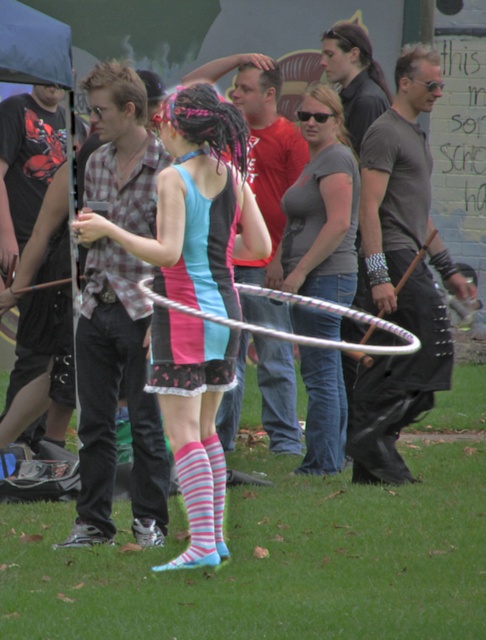
Is point (135, 595) more distant than point (314, 108)?

That is False.

Is green grass at lower center to the left of matte gray shirt at center from the viewer's perspective?

Correct, you'll find green grass at lower center to the left of matte gray shirt at center.

Describe the element at coordinates (271, 561) in the screenshot. This screenshot has height=640, width=486. I see `green grass at lower center` at that location.

The width and height of the screenshot is (486, 640). I want to click on green grass at lower center, so click(x=271, y=561).

Which is above, green grass at lower center or pink fabric skirt at center?

pink fabric skirt at center is above.

Which is in front, point (262, 609) or point (142, 324)?

Point (262, 609)

Is point (91, 579) closer to camera compared to point (143, 524)?

Yes.

Find the location of a particular element. green grass at lower center is located at coordinates (271, 561).

Which of these two, green grass at lower center or pink fabric dress at center, stands shorter?

green grass at lower center is shorter.

Which is below, green grass at lower center or pink fabric dress at center?

green grass at lower center is below.

Is point (378, 625) farther from camera compared to point (243, 237)?

No.

The width and height of the screenshot is (486, 640). I want to click on green grass at lower center, so click(x=271, y=561).